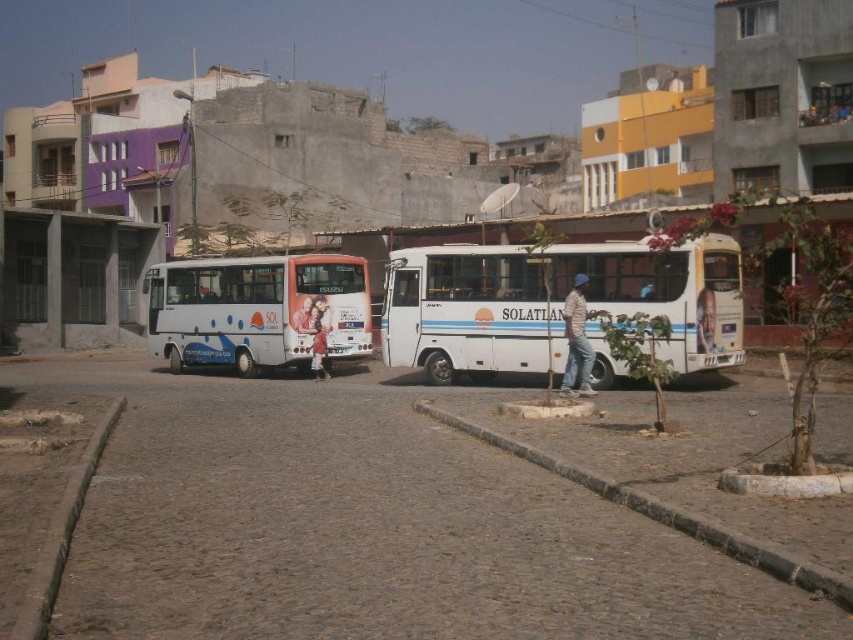
You are standing at point (78, 492) and want to take a photo of the two buses parked on the right side of the street. If your camera has a maximum focus range of 8 meters, will it be able to capture both buses clearly?

The point (78, 492) and camera are 7.98 meters apart from each other. Since the maximum focus range is 8 meters, the camera can capture both buses clearly as the distance is within the limit.

You are a pedestrian standing on the cobblestone road and want to cross to the other side. There is a brown concrete curb at lower center and blue denim jeans at center in your path. Which object should you move around first?

You should move around the brown concrete curb at lower center first since it is in front of the blue denim jeans at center, meaning it is closer to you and needs to be navigated before the latter.

You are a delivery person trying to park your van on the cobblestone road. You see the brown concrete curb at lower center and the blue denim jeans at center. Which object is closer to the ground?

The brown concrete curb at lower center is below blue denim jeans at center, so the brown concrete curb at lower center is closer to the ground.